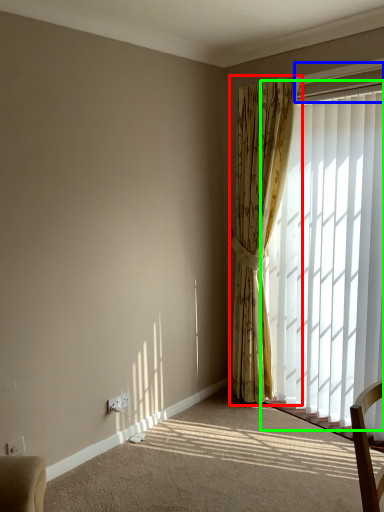
Question: Estimate the real-world distances between objects in this image. Which object is closer to curtain (highlighted by a red box), window frame (highlighted by a blue box) or window (highlighted by a green box)?

Choices:
 (A) window frame
 (B) window

Answer: (B)